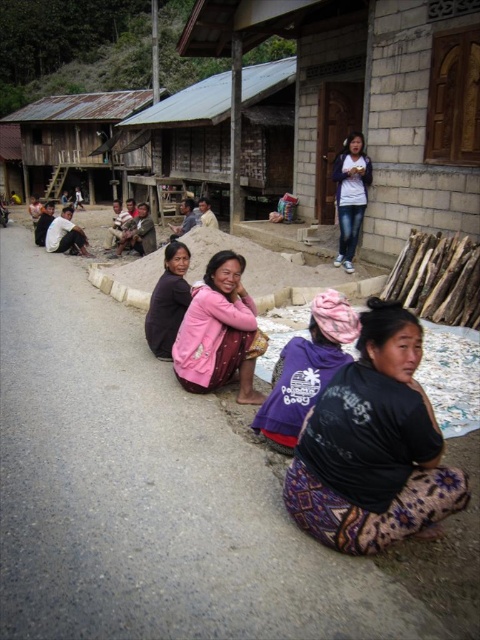
Question: Considering the relative positions of white concrete at center and jeans at upper center in the image provided, where is white concrete at center located with respect to jeans at upper center?

Choices:
 (A) below
 (B) above

Answer: (A)

Question: Is rustic wooden hut at center behind jeans at upper center?

Choices:
 (A) no
 (B) yes

Answer: (B)

Question: Which object is closer to the camera taking this photo?

Choices:
 (A) pink fabric at center
 (B) jeans at upper center
 (C) rustic wooden hut at center
 (D) white concrete at center

Answer: (D)

Question: Which object appears farthest from the camera in this image?

Choices:
 (A) dark purple fabric at center
 (B) rustic wooden hut at center

Answer: (B)

Question: Among these points, which one is nearest to the camera?

Choices:
 (A) (252, 376)
 (B) (147, 321)
 (C) (69, 208)

Answer: (A)

Question: Can you confirm if purple fabric at center is bigger than jeans at upper center?

Choices:
 (A) no
 (B) yes

Answer: (A)